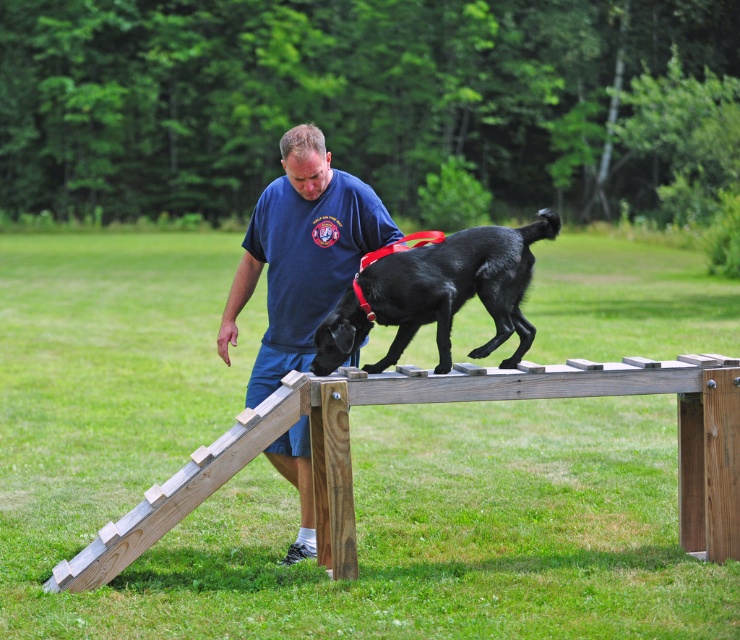
Can you confirm if wooden at center is bigger than blue cotton shirt at center?

Indeed, wooden at center has a larger size compared to blue cotton shirt at center.

Is wooden at center thinner than blue cotton shirt at center?

No.

Is point (719, 468) positioned behind point (309, 289)?

No, (719, 468) is in front of (309, 289).

Locate an element on the screen. Image resolution: width=740 pixels, height=640 pixels. wooden at center is located at coordinates (440, 401).

Can you confirm if wooden at center is thinner than shiny black dog at center?

In fact, wooden at center might be wider than shiny black dog at center.

Does wooden at center have a greater width compared to shiny black dog at center?

Correct, the width of wooden at center exceeds that of shiny black dog at center.

The width and height of the screenshot is (740, 640). What do you see at coordinates (440, 401) in the screenshot?
I see `wooden at center` at bounding box center [440, 401].

The image size is (740, 640). In order to click on wooden at center in this screenshot , I will do 440,401.

Between blue cotton shirt at center and shiny black dog at center, which one appears on the right side from the viewer's perspective?

From the viewer's perspective, shiny black dog at center appears more on the right side.

Is blue cotton shirt at center smaller than shiny black dog at center?

Actually, blue cotton shirt at center might be larger than shiny black dog at center.

Who is more distant from viewer, (275, 312) or (354, 337)?

The point (275, 312) is behind.

Find the location of `blue cotton shirt at center`. blue cotton shirt at center is located at coordinates (300, 253).